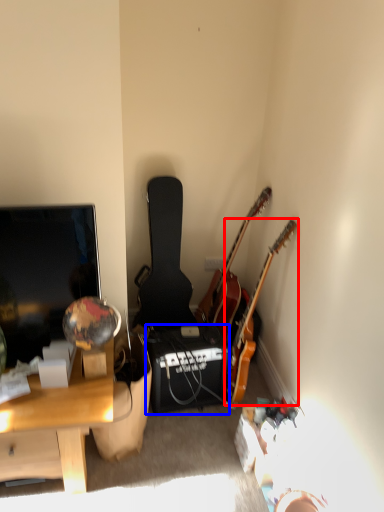
Question: Which object is closer to the camera taking this photo, guitar (highlighted by a red box) or loudspeaker (highlighted by a blue box)?

Choices:
 (A) guitar
 (B) loudspeaker

Answer: (A)